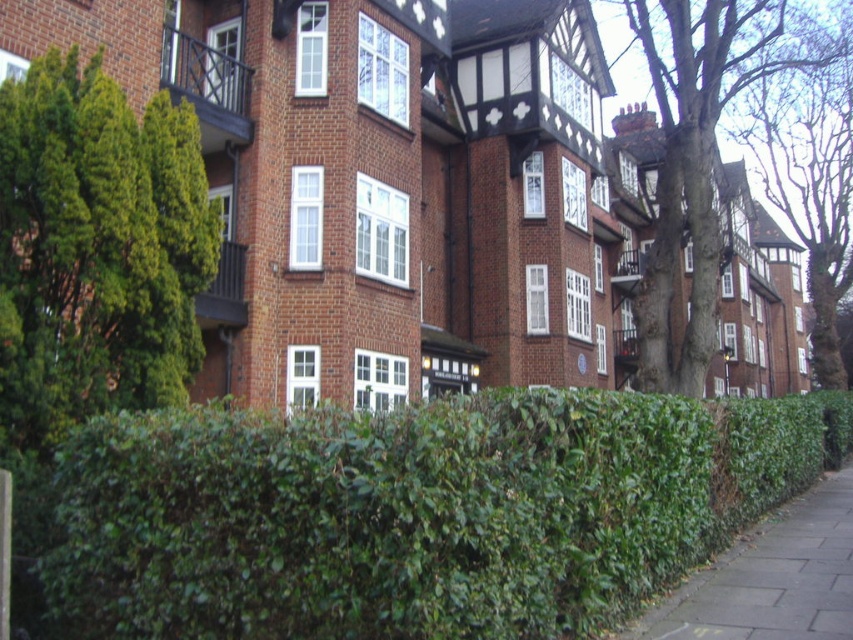
Question: Which point is farther to the camera?

Choices:
 (A) green leafy hedge at center
 (B) green leafy tree at left
 (C) green grassy hedge at lower right

Answer: (B)

Question: Is green leafy hedge at center closer to camera compared to green leafy tree at left?

Choices:
 (A) yes
 (B) no

Answer: (A)

Question: Which is farther from the green leafy hedge at center?

Choices:
 (A) bare bark tree at upper right
 (B) green grassy hedge at lower right
 (C) green leafy tree at left

Answer: (A)

Question: Is green leafy hedge at center to the right of green leafy tree at left from the viewer's perspective?

Choices:
 (A) no
 (B) yes

Answer: (B)

Question: Considering the real-world distances, which object is farthest from the green grassy hedge at lower right?

Choices:
 (A) bare bark tree at upper right
 (B) green leafy hedge at center
 (C) green leafy tree at left

Answer: (A)

Question: Is the position of green leafy tree at left less distant than that of green grassy hedge at lower right?

Choices:
 (A) no
 (B) yes

Answer: (A)